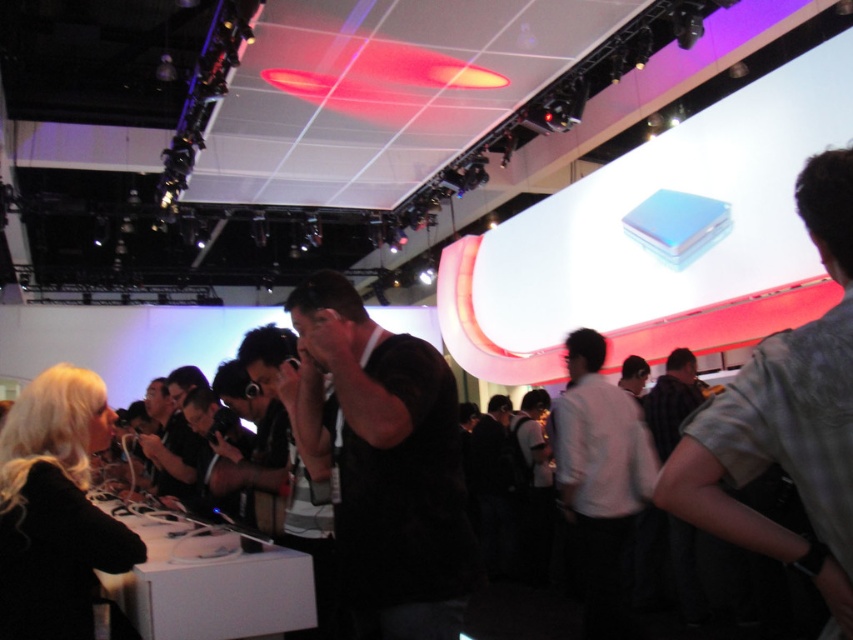
Is gray fabric shirt at right bigger than white matte shirt at center?

No, gray fabric shirt at right is not bigger than white matte shirt at center.

Between point (706, 449) and point (618, 504), which one is positioned behind?

The point (618, 504) is more distant.

Identify the location of gray fabric shirt at right. (786, 419).

Who is shorter, gray fabric shirt at right or dark brown leather jacket at center?

dark brown leather jacket at center is shorter.

Can you confirm if gray fabric shirt at right is thinner than dark brown leather jacket at center?

Indeed, gray fabric shirt at right has a lesser width compared to dark brown leather jacket at center.

Which is behind, point (851, 419) or point (653, 432)?

The point (653, 432) is behind.

Locate an element on the screen. gray fabric shirt at right is located at coordinates (786, 419).

Which is below, white matte shirt at center or dark brown leather jacket at center?

white matte shirt at center is below.

Is white matte shirt at center thinner than dark brown leather jacket at center?

Yes.

Between point (606, 604) and point (660, 445), which one is positioned in front?

Point (606, 604) is more forward.

This screenshot has width=853, height=640. I want to click on white matte shirt at center, so click(x=601, y=483).